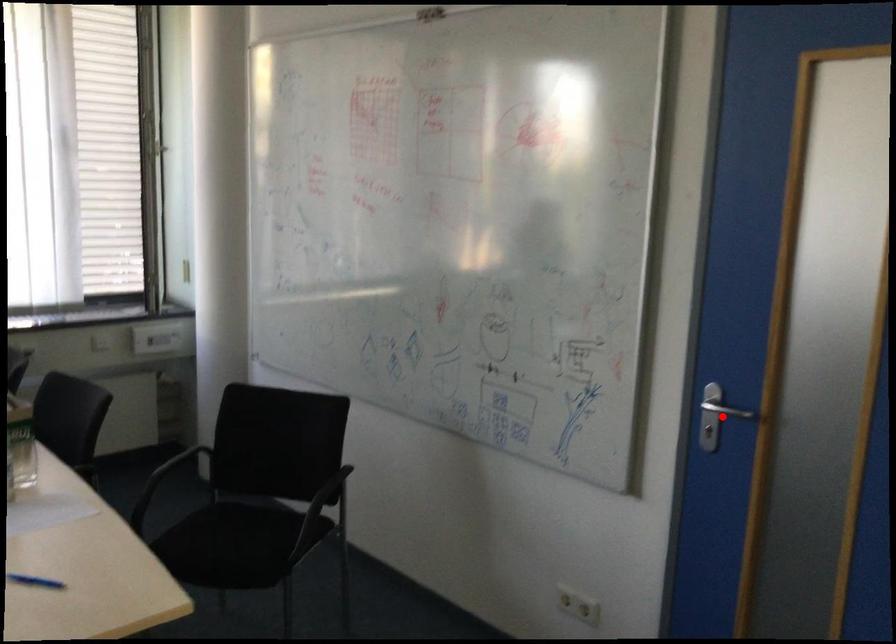
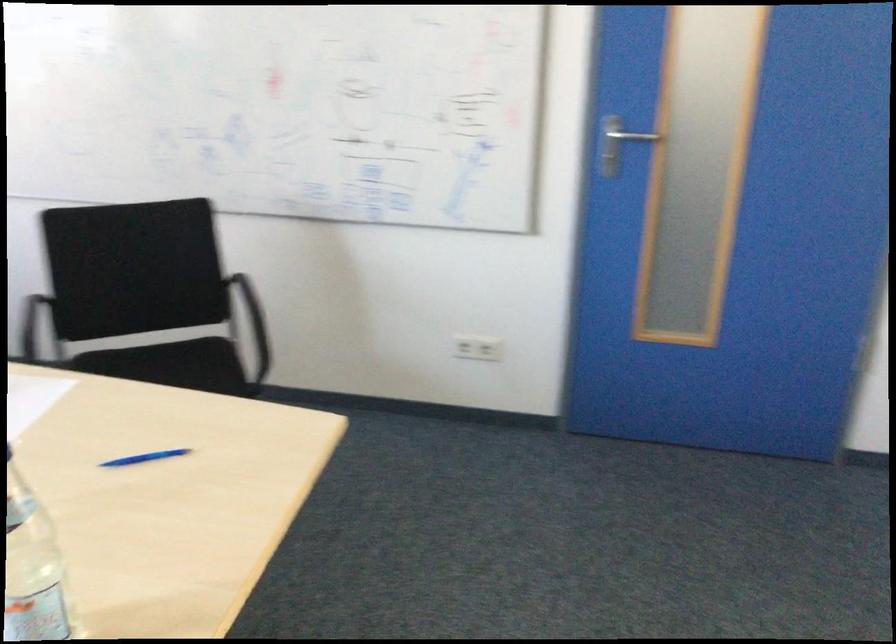
Question: A red point is marked in image1. In image2, is the corresponding 3D point closer to the camera or farther? Reply with the corresponding letter.

Choices:
 (A) The corresponding 3D point is closer.
 (B) The corresponding 3D point is farther.

Answer: (B)